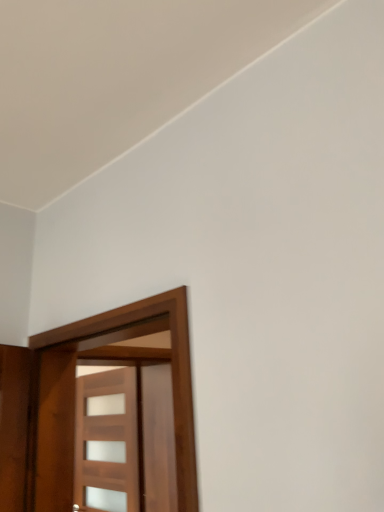
Question: From a real-world perspective, is wooden door at center, positioned as the 2th door in front-to-back order, physically below wooden door at left, which is the 2th door in back-to-front order?

Choices:
 (A) no
 (B) yes

Answer: (B)

Question: Is wooden door at center, which ranks as the 1th door in back-to-front order, looking in the opposite direction of wooden door at left, which is the 2th door in back-to-front order?

Choices:
 (A) no
 (B) yes

Answer: (A)

Question: Are wooden door at center, positioned as the 2th door in front-to-back order, and wooden door at left, which is the 2th door in back-to-front order, beside each other?

Choices:
 (A) yes
 (B) no

Answer: (B)

Question: Can you confirm if wooden door at center, which ranks as the 1th door in back-to-front order, is shorter than wooden door at left, which is the 2th door in back-to-front order?

Choices:
 (A) no
 (B) yes

Answer: (A)

Question: Can we say wooden door at center, positioned as the 2th door in front-to-back order, lies outside wooden door at left, which is the 1th door from front to back?

Choices:
 (A) no
 (B) yes

Answer: (B)

Question: Considering the relative sizes of wooden door at center, positioned as the 2th door in front-to-back order, and wooden door at left, which is the 1th door from front to back, in the image provided, is wooden door at center, positioned as the 2th door in front-to-back order, wider than wooden door at left, which is the 1th door from front to back,?

Choices:
 (A) yes
 (B) no

Answer: (B)

Question: Is wooden door at left, which is the 2th door in back-to-front order, next to wooden door at center, which ranks as the 1th door in back-to-front order, and touching it?

Choices:
 (A) no
 (B) yes

Answer: (A)

Question: Is wooden door at left, which is the 2th door in back-to-front order, at the left side of wooden door at center, positioned as the 2th door in front-to-back order?

Choices:
 (A) yes
 (B) no

Answer: (B)

Question: Considering the relative sizes of wooden door at left, which is the 1th door from front to back, and wooden door at center, which ranks as the 1th door in back-to-front order, in the image provided, is wooden door at left, which is the 1th door from front to back, bigger than wooden door at center, which ranks as the 1th door in back-to-front order,?

Choices:
 (A) yes
 (B) no

Answer: (A)

Question: Is wooden door at left, which is the 2th door in back-to-front order, at the right side of wooden door at center, positioned as the 2th door in front-to-back order?

Choices:
 (A) no
 (B) yes

Answer: (B)

Question: Is wooden door at left, which is the 2th door in back-to-front order, not near wooden door at center, which ranks as the 1th door in back-to-front order?

Choices:
 (A) yes
 (B) no

Answer: (A)

Question: From a real-world perspective, is wooden door at left, which is the 2th door in back-to-front order, located higher than wooden door at center, which ranks as the 1th door in back-to-front order?

Choices:
 (A) no
 (B) yes

Answer: (B)

Question: Is wooden door at left, which is the 1th door from front to back, situated inside wooden door at center, which ranks as the 1th door in back-to-front order, or outside?

Choices:
 (A) inside
 (B) outside

Answer: (B)